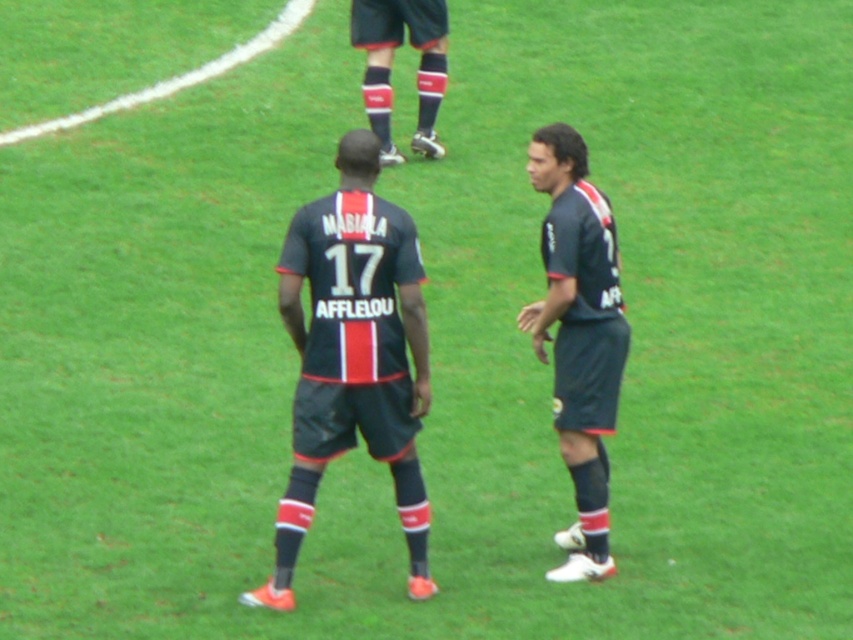
You are a soccer coach analyzing the players on the field. You notice the dark blue jersey at center and the matte black socks at upper center. Which object takes up more space in the image?

The dark blue jersey at center is bigger than the matte black socks at upper center, so the dark blue jersey at center takes up more space in the image.

You are a soccer coach analyzing the positioning of players in a match. You see the point marked at coordinates (352, 356). Which player is located at that point?

The point at coordinates (352, 356) marks the dark blue jersey at center.